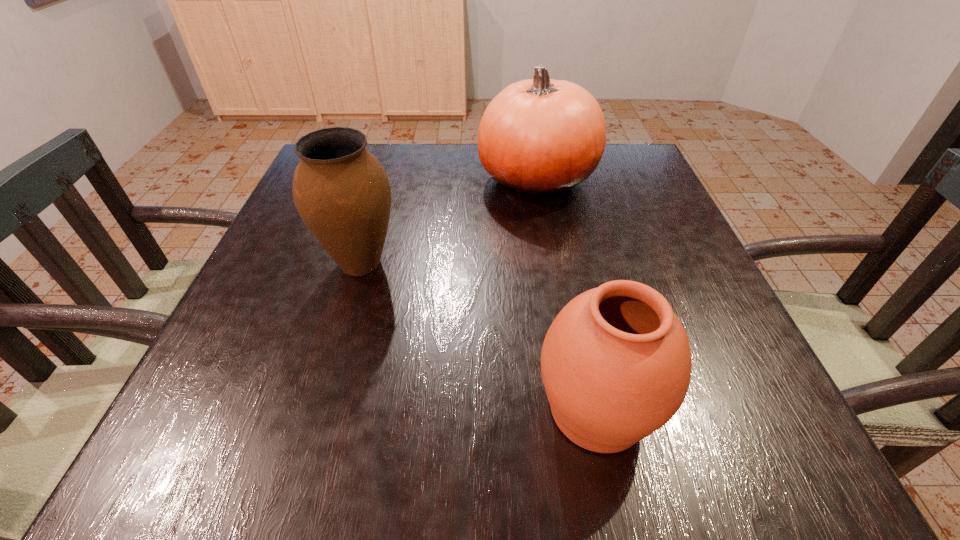
Locate an element on the screen. Image resolution: width=960 pixels, height=540 pixels. pumpkin is located at coordinates (540, 137).

Locate an element on the screen. Image resolution: width=960 pixels, height=540 pixels. the farther urn is located at coordinates (341, 191).

Where is `the left urn`? The image size is (960, 540). the left urn is located at coordinates (341, 191).

Image resolution: width=960 pixels, height=540 pixels. I want to click on the right urn, so click(616, 363).

The image size is (960, 540). I want to click on the nearest object, so click(x=616, y=363).

Where is `vacant space located 0.110m on the right of the pumpkin`? The width and height of the screenshot is (960, 540). vacant space located 0.110m on the right of the pumpkin is located at coordinates (640, 179).

Image resolution: width=960 pixels, height=540 pixels. Find the location of `vacant region located 0.080m on the right of the left urn`. vacant region located 0.080m on the right of the left urn is located at coordinates (442, 263).

Where is `vacant space located 0.180m on the left of the nearer urn`? The image size is (960, 540). vacant space located 0.180m on the left of the nearer urn is located at coordinates (413, 410).

The height and width of the screenshot is (540, 960). Identify the location of object that is at the far edge. (540, 137).

Where is `object positioned at the near edge`? object positioned at the near edge is located at coordinates (616, 363).